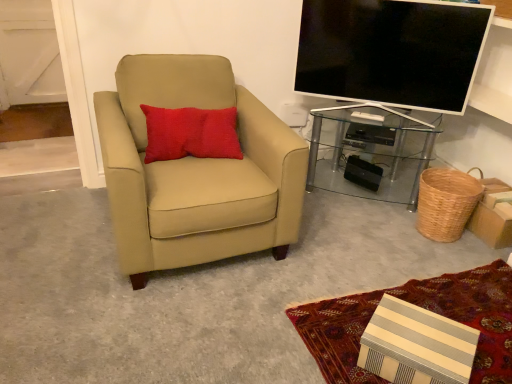
Question: From a real-world perspective, is red textured pillow at upper left above or below matte black tv at upper right?

Choices:
 (A) above
 (B) below

Answer: (B)

Question: From the image's perspective, is red textured pillow at upper left positioned above or below matte black tv at upper right?

Choices:
 (A) above
 (B) below

Answer: (B)

Question: Estimate the real-world distances between objects in this image. Which object is farther from the beige leather chair at left?

Choices:
 (A) transparent glass desk at right
 (B) red textured pillow at upper left
 (C) matte black tv at upper right
 (D) woven brown basket at lower right

Answer: (D)

Question: Estimate the real-world distances between objects in this image. Which object is closer to the red textured pillow at upper left?

Choices:
 (A) transparent glass desk at right
 (B) woven brown basket at lower right
 (C) matte black tv at upper right
 (D) beige leather chair at left

Answer: (D)